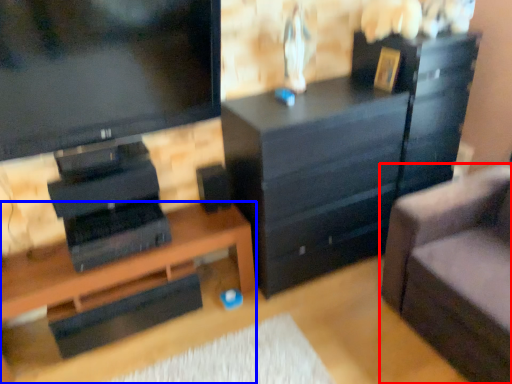
Question: Which point is further to the camera, studio couch (highlighted by a red box) or desk (highlighted by a blue box)?

Choices:
 (A) studio couch
 (B) desk

Answer: (B)